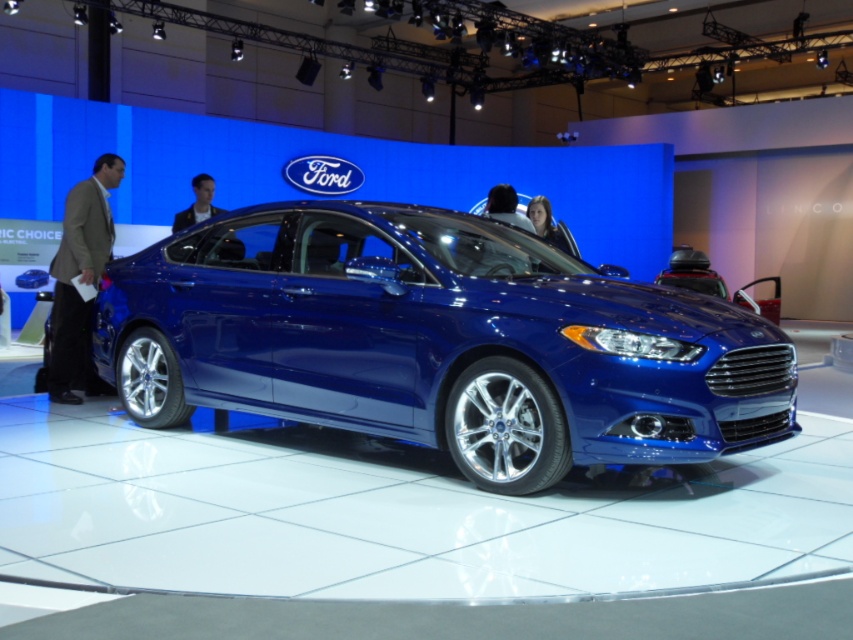
You are attending an auto show and see the glossy metallic car at center and the brown suit at left. From your perspective, which object is positioned lower?

The glossy metallic car at center is positioned lower than the brown suit at left.

In the scene shown: You are a photographer at the auto show and need to position your camera to capture the glossy metallic car at center. The camera stand can only move along the x and y axes. According to the coordinates provided, what is the exact position you should aim for to center the car?

The glossy metallic car at center is positioned at coordinates point (437, 340). Therefore, you should aim your camera at point 0.534 on the x axis and 0.513 on the y axis to center the car.

You are a photographer trying to capture a clear shot of the glossy metallic car at center and the brown suit at left. If you want to ensure both are fully visible in the frame, which object should you position closer to the camera?

The glossy metallic car at center might be wider than brown suit at left, so positioning the brown suit at left closer to the camera would allow both to fit within the frame while maintaining visibility.